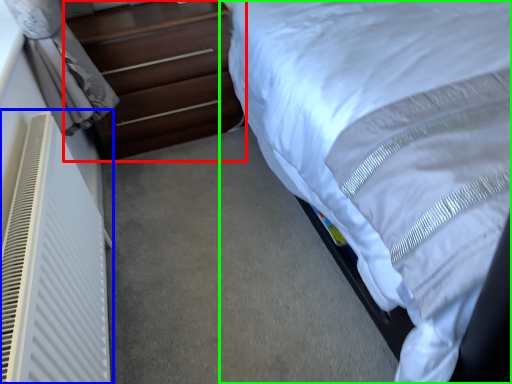
Question: Which is farther away from chest of drawers (highlighted by a red box)? air conditioner (highlighted by a blue box) or bed (highlighted by a green box)?

Choices:
 (A) air conditioner
 (B) bed

Answer: (A)